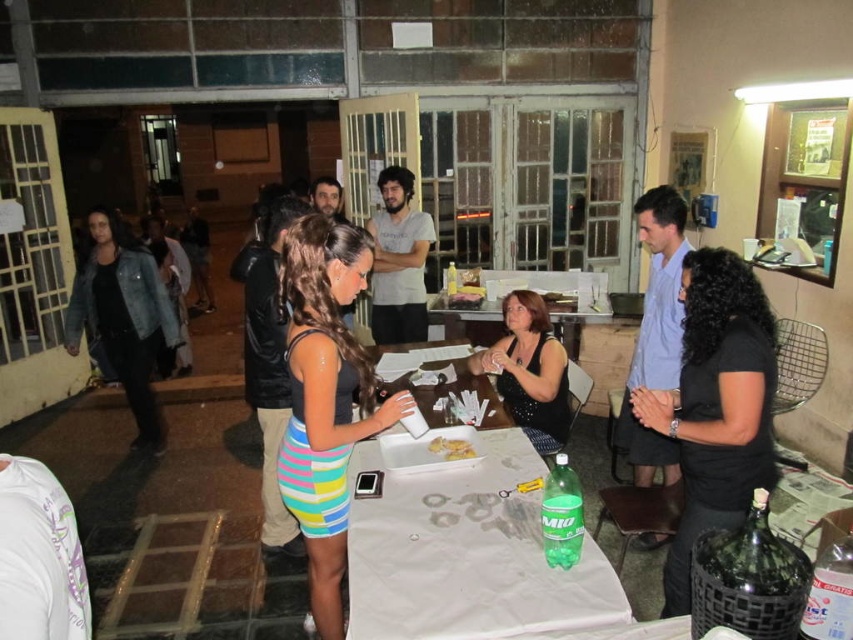
Question: Is white paper table at center above black sequined dress at center?

Choices:
 (A) no
 (B) yes

Answer: (A)

Question: Which point is closer to the camera?

Choices:
 (A) (440, 470)
 (B) (473, 456)

Answer: (A)

Question: Which of the following is the farthest from the observer?

Choices:
 (A) (453, 445)
 (B) (311, 403)
 (C) (715, 330)

Answer: (A)

Question: Is white paper table at center thinner than black matte shirt at center?

Choices:
 (A) yes
 (B) no

Answer: (B)

Question: Among these objects, which one is farthest from the camera?

Choices:
 (A) black sequined dress at center
 (B) multicolored striped dress at center
 (C) black matte shirt at center
 (D) yellow crumbly cake at center

Answer: (A)

Question: In this image, where is black matte shirt at center located relative to yellow crumbly cake at center?

Choices:
 (A) above
 (B) below

Answer: (A)